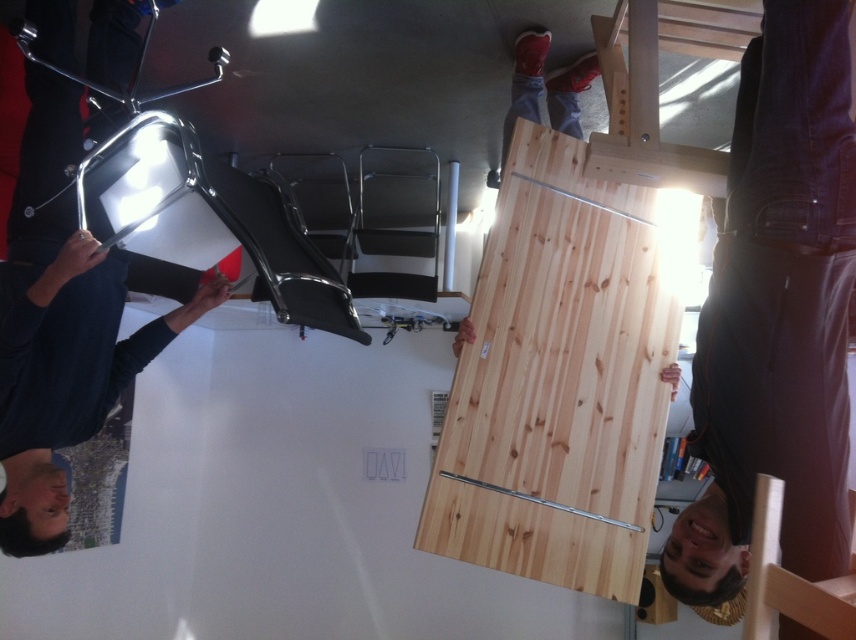
Image resolution: width=856 pixels, height=640 pixels. I want to click on metallic gray lift at center, so click(396, 224).

Between metallic gray lift at center and natural wood beam at center, which one appears on the left side from the viewer's perspective?

metallic gray lift at center

The image size is (856, 640). What are the coordinates of `metallic gray lift at center` in the screenshot? It's located at (396, 224).

Can you confirm if jeans at lower right is positioned above red leather shoes at upper center?

No.

Is jeans at lower right positioned at the back of red leather shoes at upper center?

No, it is not.

Image resolution: width=856 pixels, height=640 pixels. Find the location of `jeans at lower right`. jeans at lower right is located at coordinates (777, 314).

You are a GUI agent. You are given a task and a screenshot of the screen. Output one action in this format:
    pyautogui.click(x=<x>, y=<y>)
    Task: Click on the jeans at lower right
    This screenshot has height=640, width=856.
    Given the screenshot: What is the action you would take?
    pyautogui.click(x=777, y=314)

Is point (613, 584) in front of point (590, 61)?

Yes, point (613, 584) is closer to viewer.

Does natural wood plywood at center have a larger size compared to red leather shoes at upper center?

Indeed, natural wood plywood at center has a larger size compared to red leather shoes at upper center.

Which is in front, point (599, 595) or point (516, 74)?

Point (599, 595) is more forward.

I want to click on natural wood plywood at center, so click(562, 376).